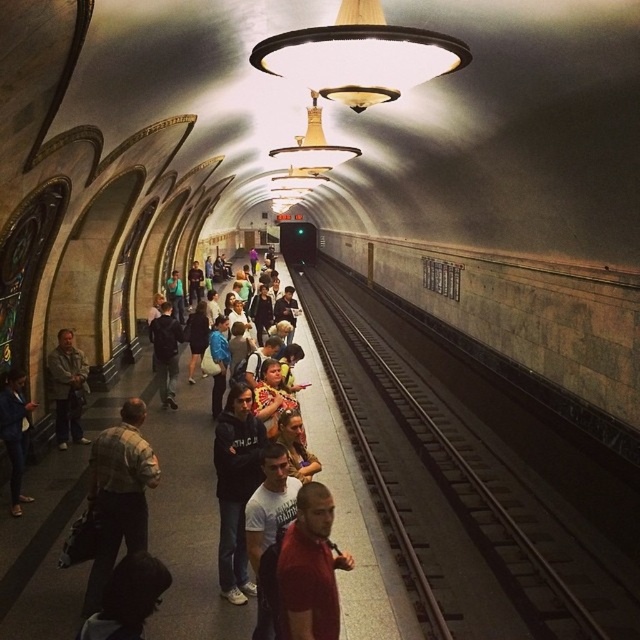
Question: Which point is farther to the camera?

Choices:
 (A) (257, 449)
 (B) (316, 522)
 (C) (284, 253)
 (D) (20, 397)

Answer: (C)

Question: Considering the real-world distances, which object is farthest from the black metal train track at center?

Choices:
 (A) denim jacket at left
 (B) dark gray jacket at left

Answer: (A)

Question: Can you confirm if black metal train track at center is thinner than black matte jacket at center?

Choices:
 (A) yes
 (B) no

Answer: (B)

Question: In this image, where is black matte jacket at center located relative to green matte train at center?

Choices:
 (A) left
 (B) right

Answer: (B)

Question: Is black metal train track at center to the left of green matte train at center from the viewer's perspective?

Choices:
 (A) no
 (B) yes

Answer: (A)

Question: Among these points, which one is nearest to the camera?

Choices:
 (A) (244, 534)
 (B) (60, 336)
 (C) (124, 426)

Answer: (A)